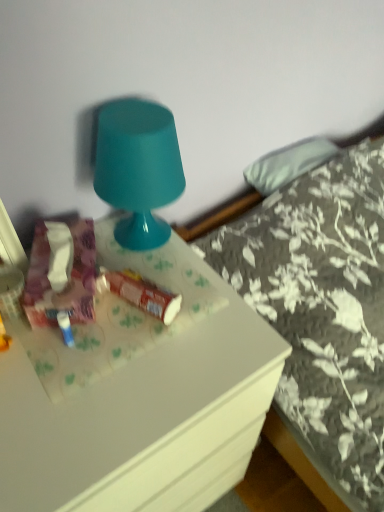
The image size is (384, 512). Find the location of `vacant region above white glossy desk at center (from a real-world perspective)`. vacant region above white glossy desk at center (from a real-world perspective) is located at coordinates (110, 354).